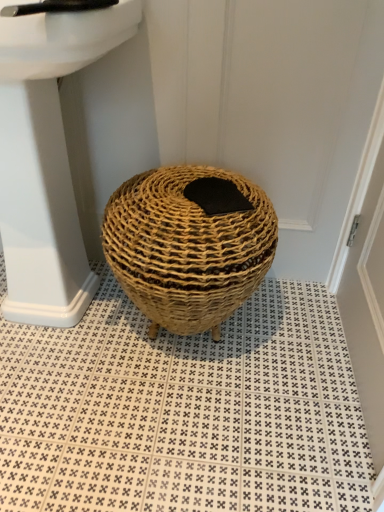
Question: Is white glossy sink at upper left looking in the opposite direction of black felt pad at center?

Choices:
 (A) no
 (B) yes

Answer: (A)

Question: Does white glossy sink at upper left have a smaller size compared to black felt pad at center?

Choices:
 (A) yes
 (B) no

Answer: (B)

Question: Does white glossy sink at upper left have a larger size compared to black felt pad at center?

Choices:
 (A) no
 (B) yes

Answer: (B)

Question: From the image's perspective, is white glossy sink at upper left under black felt pad at center?

Choices:
 (A) yes
 (B) no

Answer: (B)

Question: Does white glossy sink at upper left have a lesser width compared to black felt pad at center?

Choices:
 (A) no
 (B) yes

Answer: (A)

Question: Is white glossy sink at upper left completely or partially outside of black felt pad at center?

Choices:
 (A) yes
 (B) no

Answer: (A)

Question: Is black felt pad at center thinner than black plastic faucet at upper left?

Choices:
 (A) no
 (B) yes

Answer: (B)

Question: Is black felt pad at center positioned with its back to black plastic faucet at upper left?

Choices:
 (A) no
 (B) yes

Answer: (A)

Question: Is the position of black felt pad at center less distant than that of black plastic faucet at upper left?

Choices:
 (A) yes
 (B) no

Answer: (B)

Question: From the image's perspective, is black felt pad at center on top of black plastic faucet at upper left?

Choices:
 (A) yes
 (B) no

Answer: (B)

Question: Considering the relative sizes of black felt pad at center and black plastic faucet at upper left in the image provided, is black felt pad at center wider than black plastic faucet at upper left?

Choices:
 (A) yes
 (B) no

Answer: (B)

Question: Does black felt pad at center touch black plastic faucet at upper left?

Choices:
 (A) yes
 (B) no

Answer: (B)

Question: From the image's perspective, would you say natural woven basket at center is positioned over black felt pad at center?

Choices:
 (A) yes
 (B) no

Answer: (B)